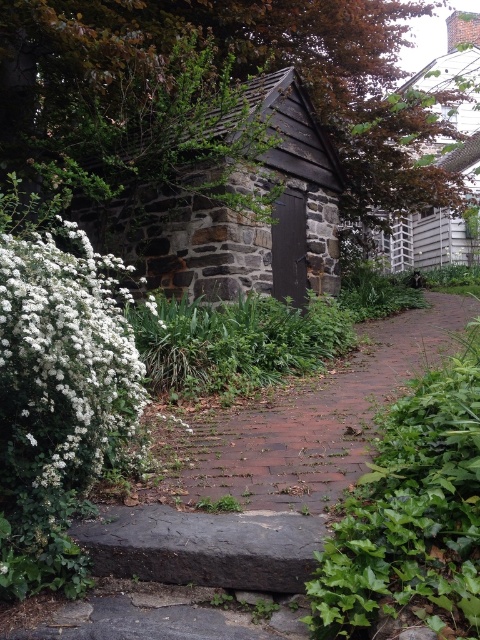
You are a visitor standing at the entrance of the garden. You see the dark brown stone log cabin at center and the brick at center. Which object is larger in size?

The dark brown stone log cabin at center is bigger than the brick at center according to the description.